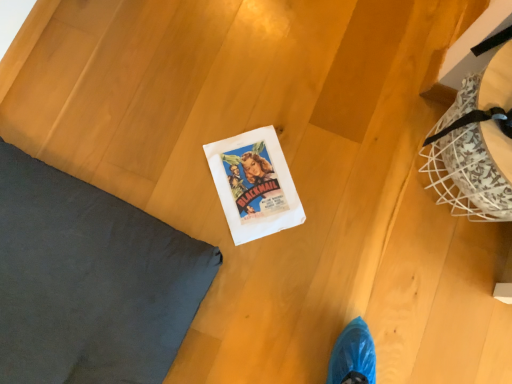
This screenshot has width=512, height=384. Identify the location of free point behind white paper comic book at center. (266, 89).